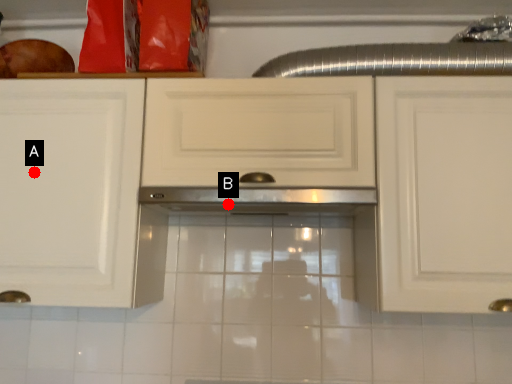
Question: Two points are circled on the image, labeled by A and B beside each circle. Which point is closer to the camera?

Choices:
 (A) A is closer
 (B) B is closer

Answer: (A)